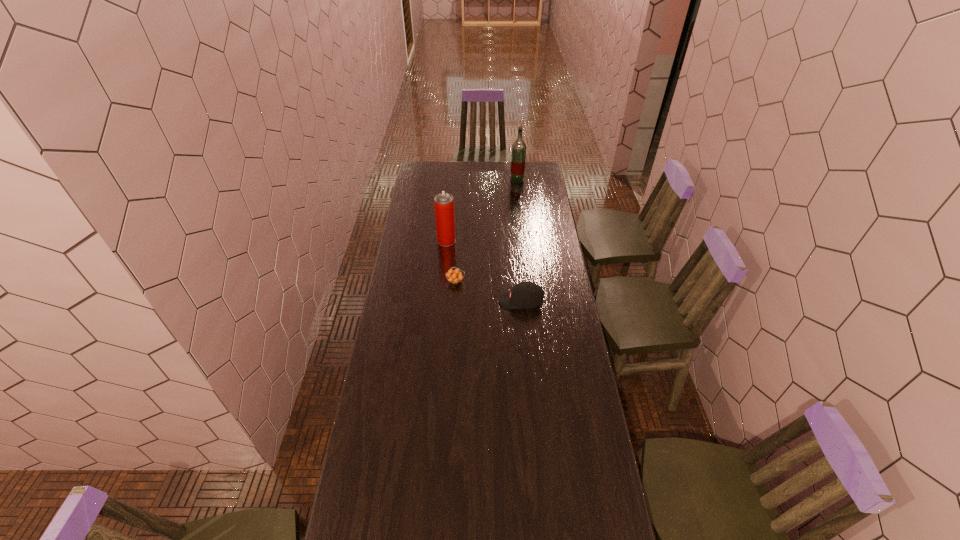
I want to click on free spot between the liquor and the shortest object, so click(x=487, y=231).

At what (x,y) coordinates should I click in order to perform the action: click on empty space between the aerosol can and the second nearest object. Please return your answer as a coordinate pair (x, y). Looking at the image, I should click on click(x=451, y=261).

The image size is (960, 540). What are the coordinates of `vacant point located between the third nearest object and the liquor` in the screenshot? It's located at (482, 211).

The height and width of the screenshot is (540, 960). I want to click on free space that is in between the third tallest object and the orange fruit, so click(x=489, y=292).

Locate an element on the screen. Image resolution: width=960 pixels, height=540 pixels. unoccupied area between the orange fruit and the liquor is located at coordinates (487, 231).

The height and width of the screenshot is (540, 960). Find the location of `vacant area between the third shortest object and the nearest object`. vacant area between the third shortest object and the nearest object is located at coordinates (484, 271).

At what (x,y) coordinates should I click in order to perform the action: click on free spot between the third shortest object and the second shortest object. Please return your answer as a coordinate pair (x, y). Looking at the image, I should click on (484, 271).

Where is `empty location between the farthest object and the aerosol can`? The height and width of the screenshot is (540, 960). empty location between the farthest object and the aerosol can is located at coordinates (482, 211).

Where is `free space between the third nearest object and the farthest object`? Image resolution: width=960 pixels, height=540 pixels. free space between the third nearest object and the farthest object is located at coordinates (482, 211).

Where is `unoccupied area between the second nearest object and the liquor`? This screenshot has width=960, height=540. unoccupied area between the second nearest object and the liquor is located at coordinates (487, 231).